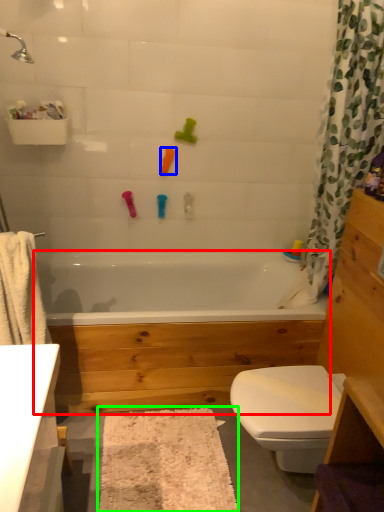
Question: Based on their relative distances, which object is nearer to bathtub (highlighted by a red box)? Choose from toy (highlighted by a blue box) and bath mat (highlighted by a green box).

Choices:
 (A) toy
 (B) bath mat

Answer: (B)